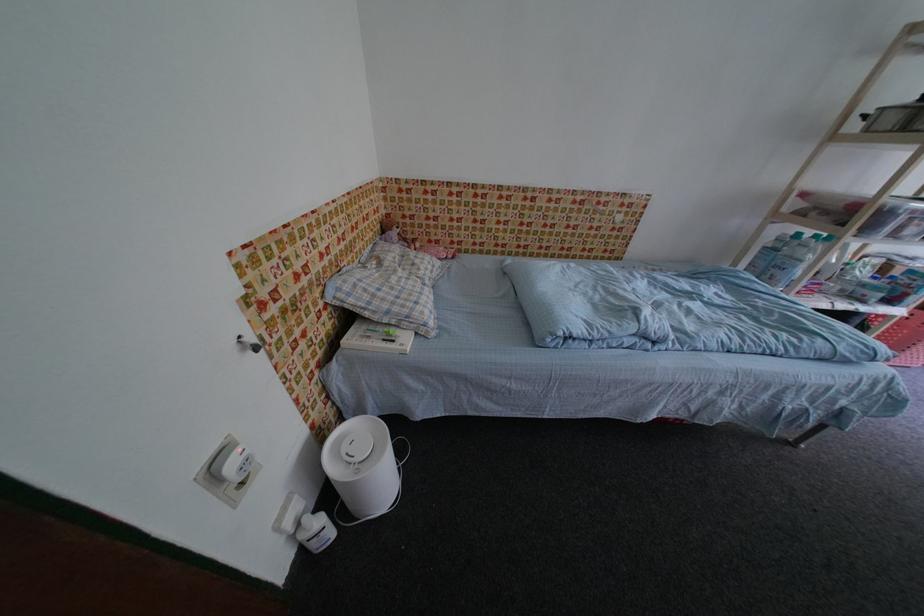
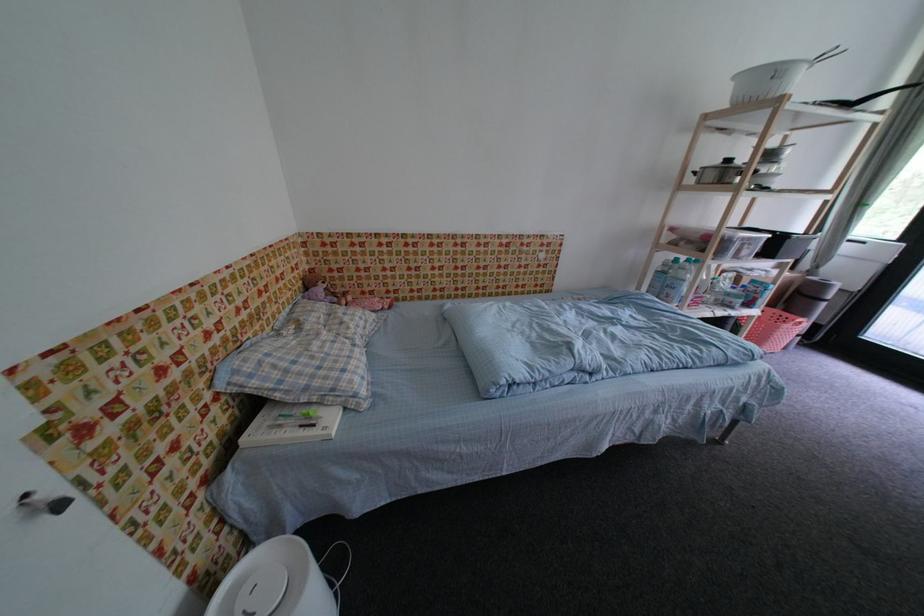
The images are taken continuously from a first-person perspective. In which direction are you moving?

The movement direction of the cameraman is right, forward.